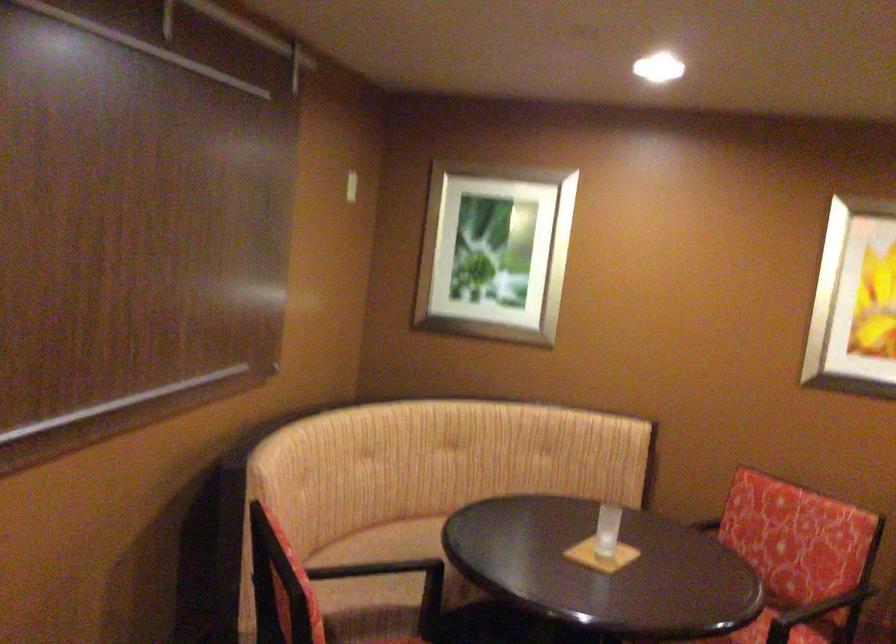
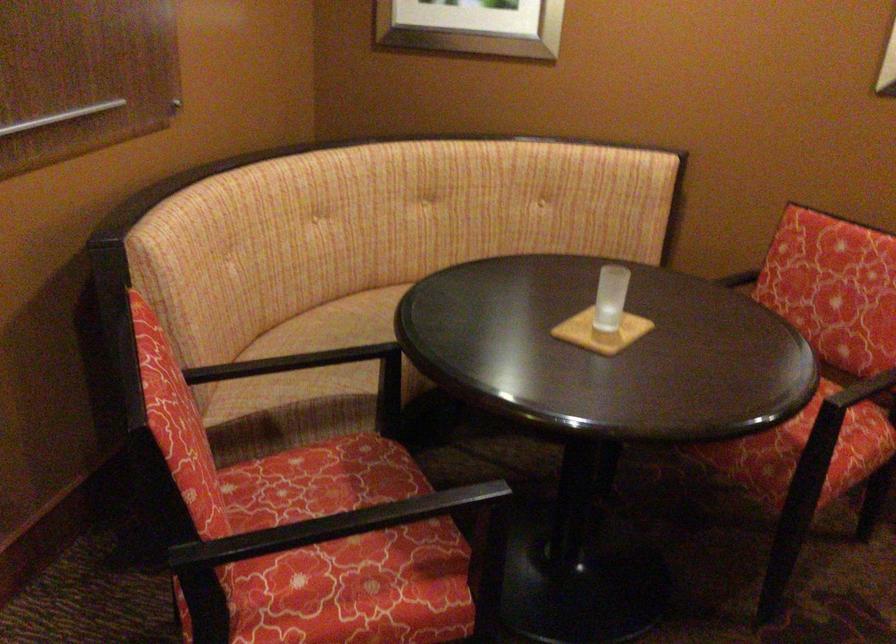
The point at [602,540] is marked in the first image. Where is the corresponding point in the second image?

(609, 297)